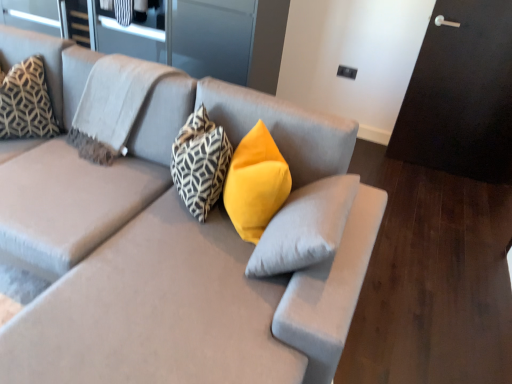
Question: Looking at their shapes, would you say patterned fabric pillow at upper left, the 3th pillow in the right-to-left sequence, is wider or thinner than matte gray couch at center?

Choices:
 (A) wide
 (B) thin

Answer: (B)

Question: Is patterned fabric pillow at upper left, which appears as the second pillow when viewed from the left, in front of or behind matte gray couch at center in the image?

Choices:
 (A) front
 (B) behind

Answer: (B)

Question: Estimate the real-world distances between objects in this image. Which object is closer to the geometric-patterned fabric pillow at upper left, which is the 1th pillow from left to right?

Choices:
 (A) matte gray couch at center
 (B) patterned fabric pillow at upper left, the 3th pillow in the right-to-left sequence
 (C) yellow velvet pillow at center, placed as the 1th pillow when sorted from right to left
 (D) geometric-patterned fabric pillow at center, acting as the 3th pillow starting from the left

Answer: (B)

Question: Based on their relative distances, which object is farther from the geometric-patterned fabric pillow at center, which is the second pillow in right-to-left order?

Choices:
 (A) matte gray couch at center
 (B) geometric-patterned fabric pillow at upper left, the 4th pillow viewed from the right
 (C) patterned fabric pillow at upper left, which appears as the second pillow when viewed from the left
 (D) yellow velvet pillow at center, placed as the 1th pillow when sorted from right to left

Answer: (B)